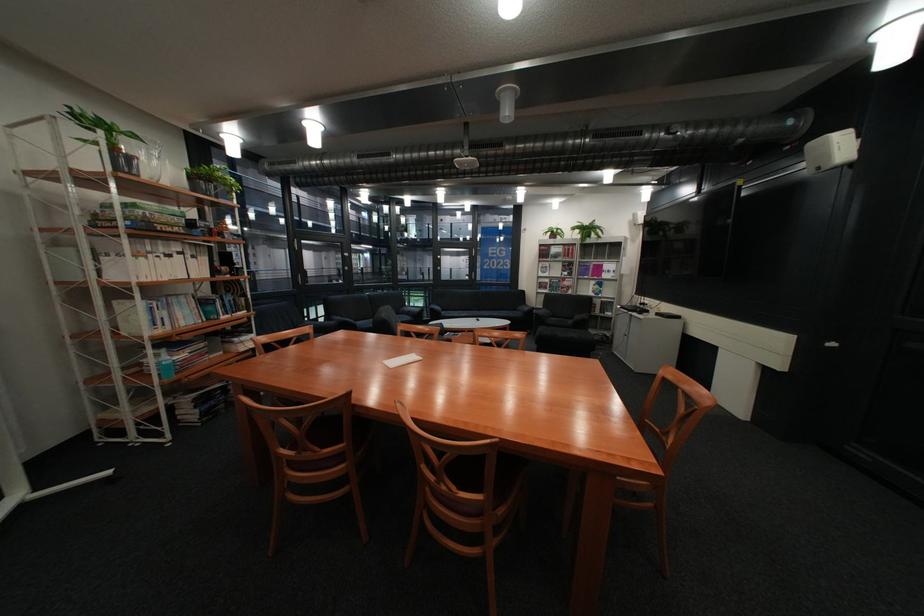
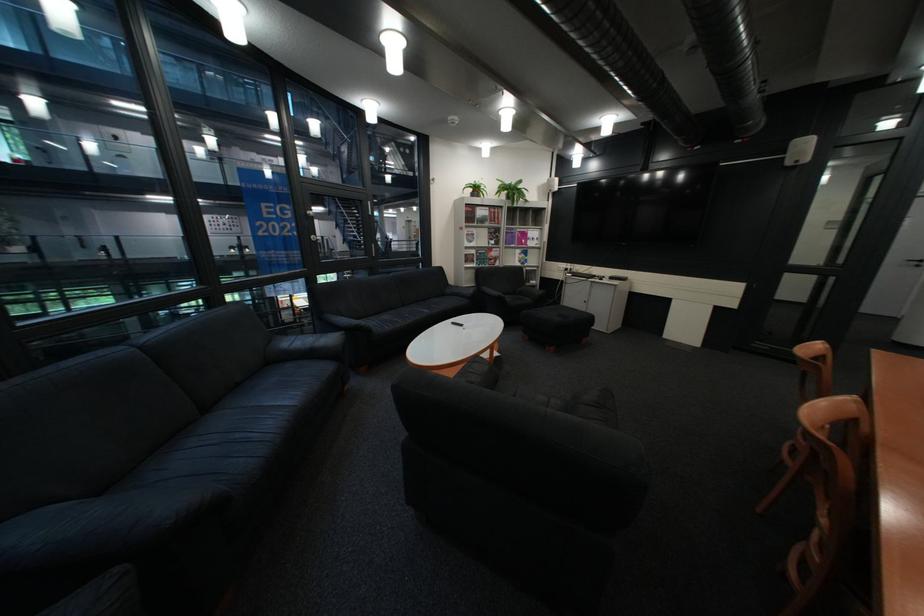
Find the pixel in the second image that matches the point at 555,245 in the first image.

(481, 205)